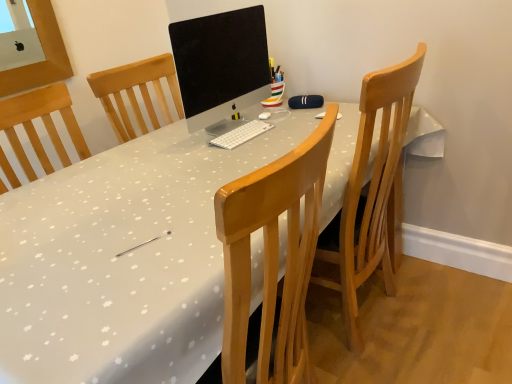
You are a GUI agent. You are given a task and a screenshot of the screen. Output one action in this format:
    pyautogui.click(x=<x>, y=<y>)
    Task: Click on the free space that is to the left of matte black monitor at center
    The image size is (512, 384).
    Given the screenshot: What is the action you would take?
    pyautogui.click(x=138, y=150)